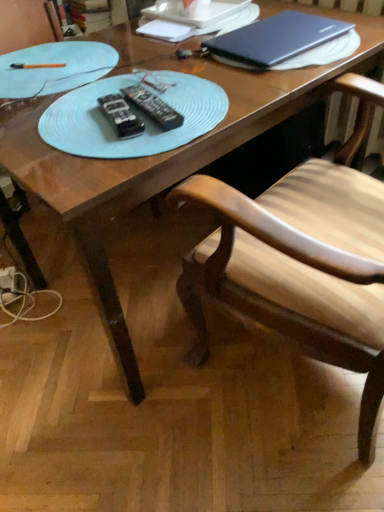
Identify the location of free space between black plastic remote at center, which is the second remote in right-to-left order, and light blue plastic plate at upper left. The image size is (384, 512). (87, 100).